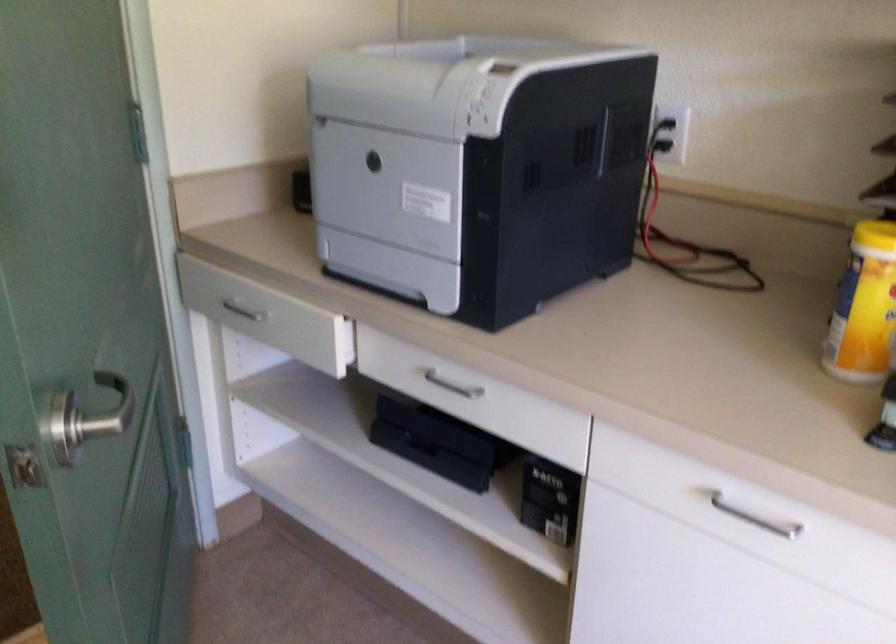
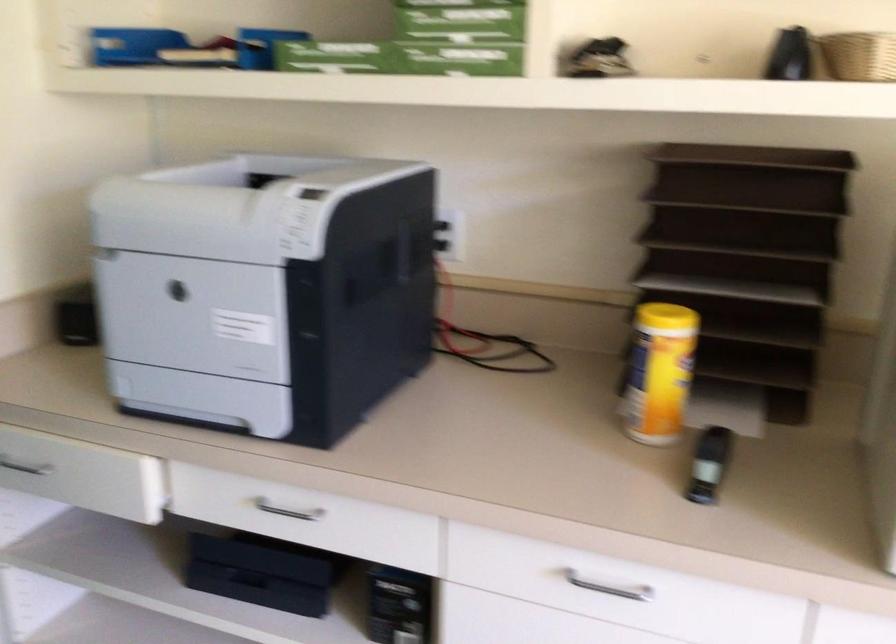
In the second image, find the point that corresponds to (x=748, y=516) in the first image.

(607, 585)